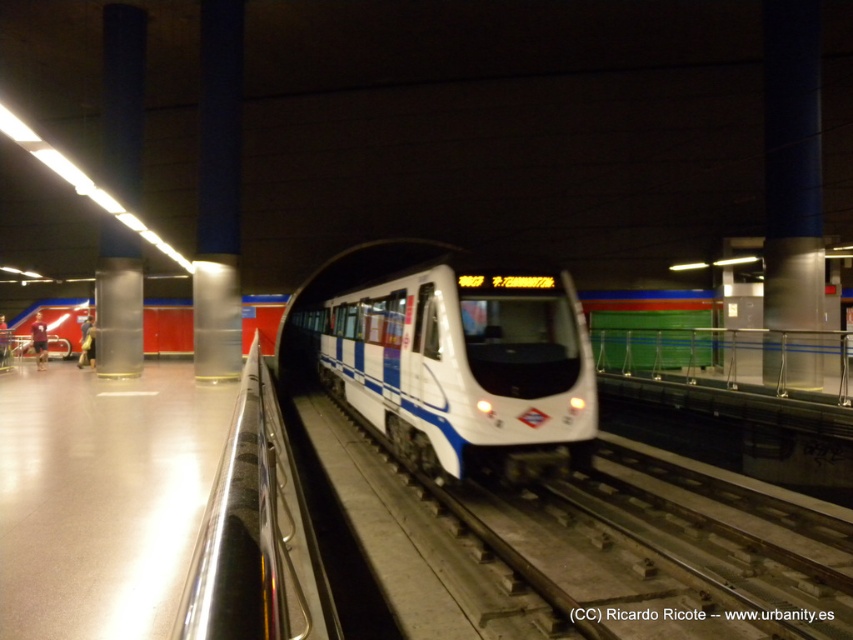
Question: Where is white glossy passenger train at center located in relation to polished metal rail at center in the image?

Choices:
 (A) above
 (B) below

Answer: (A)

Question: Does white glossy passenger train at center appear on the right side of polished metal rail at center?

Choices:
 (A) yes
 (B) no

Answer: (A)

Question: Which of the following is the closest to the observer?

Choices:
 (A) 245,470
 (B) 494,284

Answer: (A)

Question: Which object is closer to the camera taking this photo?

Choices:
 (A) polished metal rail at center
 (B) white glossy passenger train at center

Answer: (A)

Question: Is the position of white glossy passenger train at center less distant than that of polished metal rail at center?

Choices:
 (A) yes
 (B) no

Answer: (B)